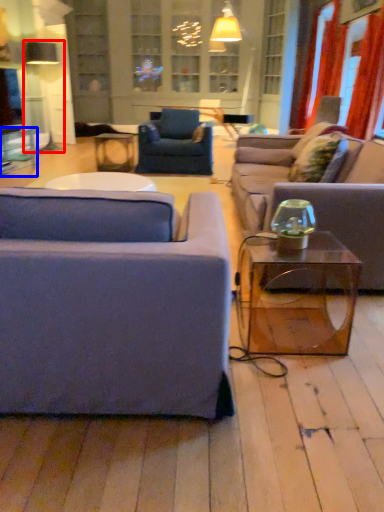
Question: Which point is further to the camera, lamp (highlighted by a red box) or table (highlighted by a blue box)?

Choices:
 (A) lamp
 (B) table

Answer: (A)